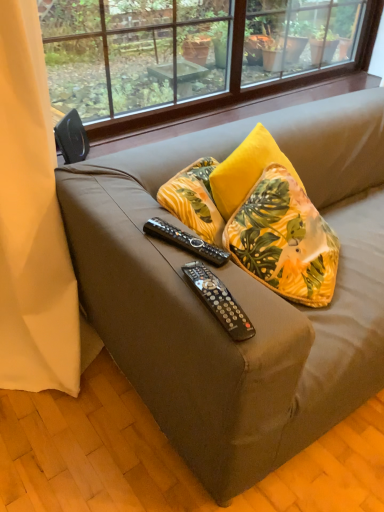
The height and width of the screenshot is (512, 384). I want to click on vacant space to the right of black plastic remote at center, which is counted as the first remote control, starting from the bottom, so click(268, 309).